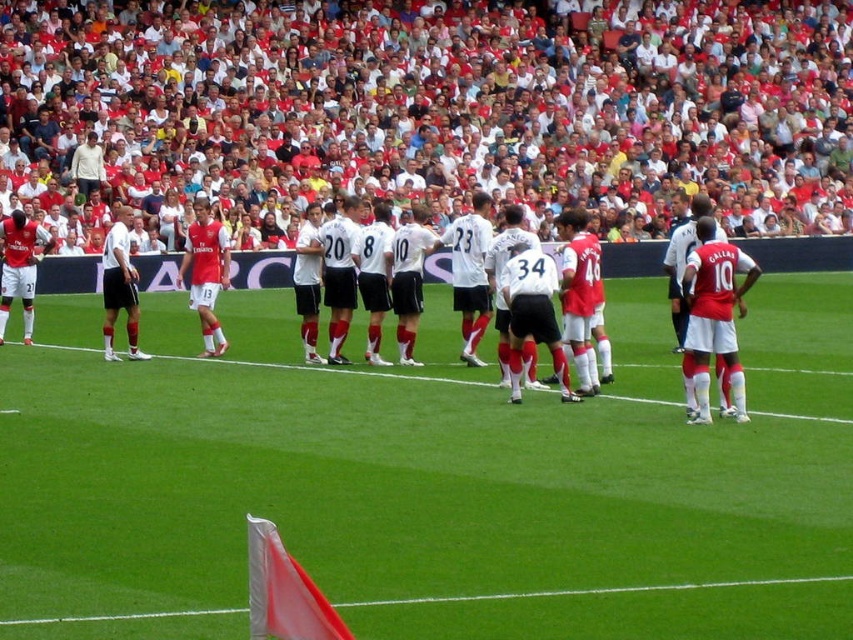
You are a photographer trying to capture a closeup of the matte red shorts at right and the white matte jersey at center. Based on their sizes, which one should you zoom in on more to ensure both fit in the frame?

The matte red shorts at right are wider than the white matte jersey at center, so you should zoom in more on the white matte jersey at center to ensure both fit in the frame.

You are a soccer referee standing at the center circle. You need to determine which of the two points, point (711, 307) or point (132, 291), is closer to the goal line. Based on their positions, which point is closer?

Point (711, 307) is in front of point (132, 291), meaning it is closer to the goal line.